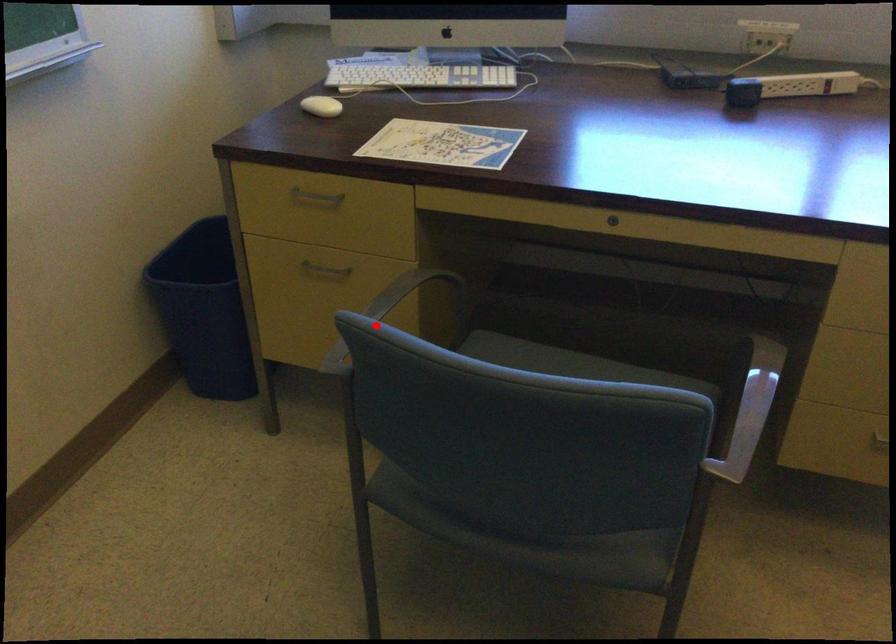
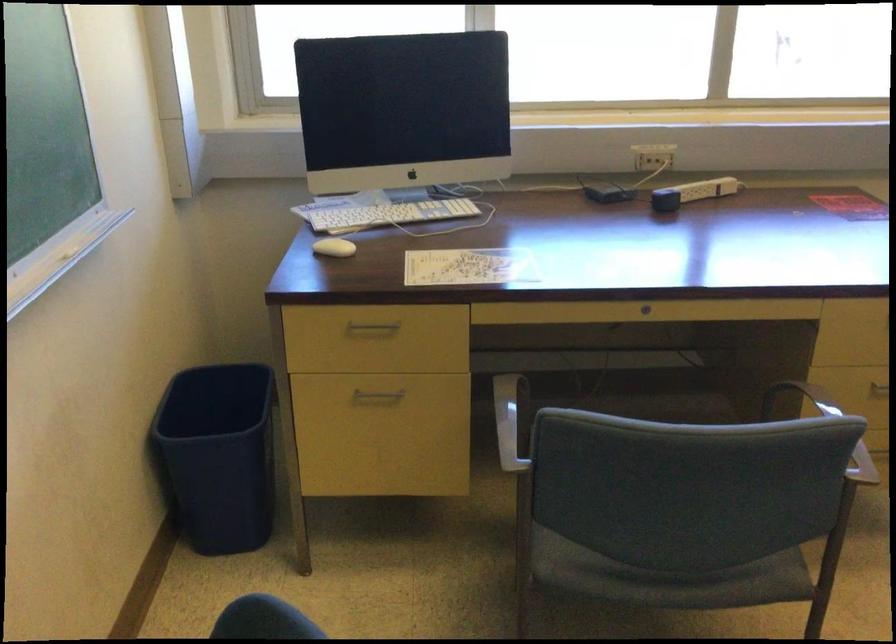
Locate, in the second image, the point that corresponds to the highlighted location in the first image.

(511, 421)